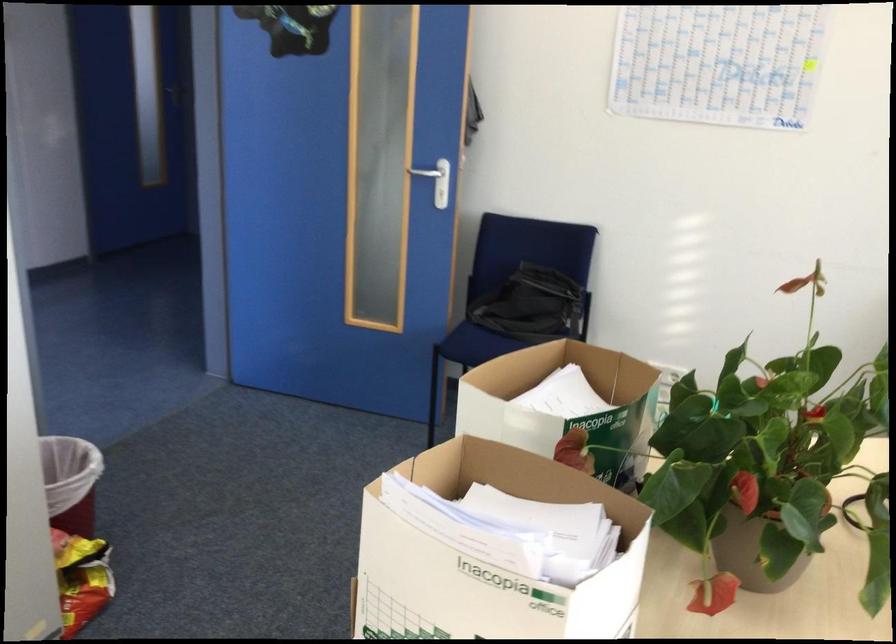
Locate an element on the screen. blue chair sitting surface is located at coordinates (515, 275).